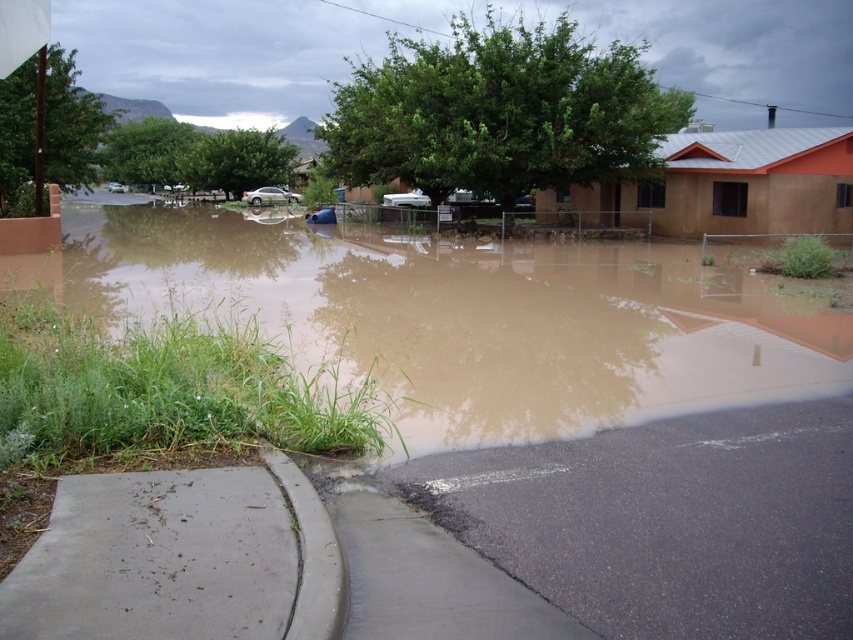
You are a delivery person trying to navigate through the flooded area. You need to deliver a package to a location marked by point (x=479, y=394). There is a flooded area between you and the destination. There is another point (x=334, y=611) in the path. Which point should you avoid to reach your destination safely?

You should avoid point (x=334, y=611) because point (x=479, y=394) is behind it, meaning the flooded area near point (x=334, y=611) might be deeper or more obstructed, making it safer to go around that point to reach your destination.

You are standing at the edge of the flooded area and want to reach a safe point. You see two points marked in the image, point (x=790, y=305) and point (x=344, y=513). Which point is closer to you so you can reach it first?

Point (x=790, y=305) is further to the viewer than point (x=344, y=513), so the closer point to you is point (x=344, y=513). You should head towards point (x=344, y=513) first.